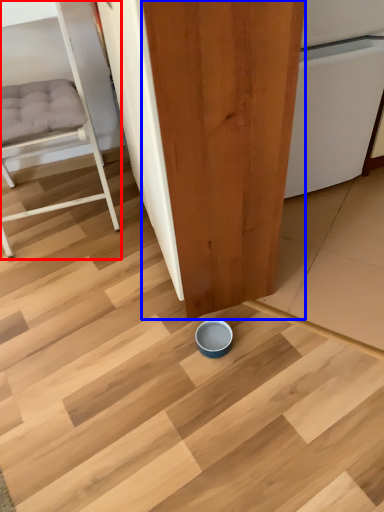
Question: Which of the following is the farthest to the observer, furniture (highlighted by a red box) or plywood (highlighted by a blue box)?

Choices:
 (A) furniture
 (B) plywood

Answer: (A)